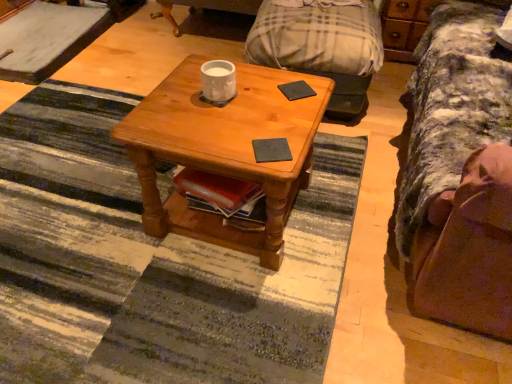
Locate an element on the screen. The height and width of the screenshot is (384, 512). free area in between white glossy mug at center and black matte pad at center, the first pad from the bottom is located at coordinates (242, 121).